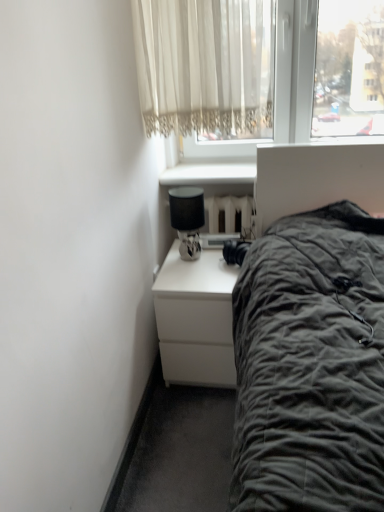
Question: Is the depth of matte black lamp at upper right greater than that of white matte nightstand at lower center?

Choices:
 (A) no
 (B) yes

Answer: (B)

Question: Can you confirm if matte black lamp at upper right is positioned to the left of white matte nightstand at lower center?

Choices:
 (A) yes
 (B) no

Answer: (A)

Question: Is matte black lamp at upper right at the right side of white matte nightstand at lower center?

Choices:
 (A) no
 (B) yes

Answer: (A)

Question: From a real-world perspective, is matte black lamp at upper right over white matte nightstand at lower center?

Choices:
 (A) no
 (B) yes

Answer: (B)

Question: Considering the relative positions of matte black lamp at upper right and white matte nightstand at lower center in the image provided, is matte black lamp at upper right in front of white matte nightstand at lower center?

Choices:
 (A) no
 (B) yes

Answer: (A)

Question: Considering the relative positions of white matte nightstand at lower center and matte black lamp at upper right in the image provided, is white matte nightstand at lower center to the left or to the right of matte black lamp at upper right?

Choices:
 (A) left
 (B) right

Answer: (B)

Question: Choose the correct answer: Is white matte nightstand at lower center inside matte black lamp at upper right or outside it?

Choices:
 (A) outside
 (B) inside

Answer: (A)

Question: In terms of size, does white matte nightstand at lower center appear bigger or smaller than matte black lamp at upper right?

Choices:
 (A) big
 (B) small

Answer: (A)

Question: Is white matte nightstand at lower center taller or shorter than matte black lamp at upper right?

Choices:
 (A) short
 (B) tall

Answer: (B)

Question: Looking at the image, does white matte nightstand at lower center seem bigger or smaller compared to white lace curtain at upper center?

Choices:
 (A) big
 (B) small

Answer: (A)

Question: From the image's perspective, is white matte nightstand at lower center positioned above or below white lace curtain at upper center?

Choices:
 (A) below
 (B) above

Answer: (A)

Question: Is white matte nightstand at lower center inside the boundaries of white lace curtain at upper center, or outside?

Choices:
 (A) inside
 (B) outside

Answer: (B)

Question: Looking at their shapes, would you say white matte nightstand at lower center is wider or thinner than white lace curtain at upper center?

Choices:
 (A) thin
 (B) wide

Answer: (B)

Question: Considering their positions, is matte black lamp at upper right located in front of or behind white lace curtain at upper center?

Choices:
 (A) behind
 (B) front

Answer: (A)

Question: Which is correct: matte black lamp at upper right is inside white lace curtain at upper center, or outside of it?

Choices:
 (A) outside
 (B) inside

Answer: (A)